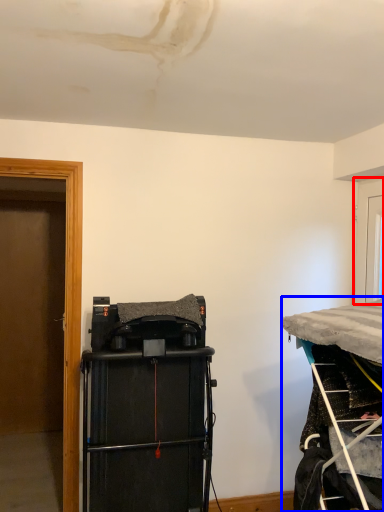
Question: Which object appears closest to the camera in this image, door (highlighted by a red box) or furniture (highlighted by a blue box)?

Choices:
 (A) door
 (B) furniture

Answer: (B)